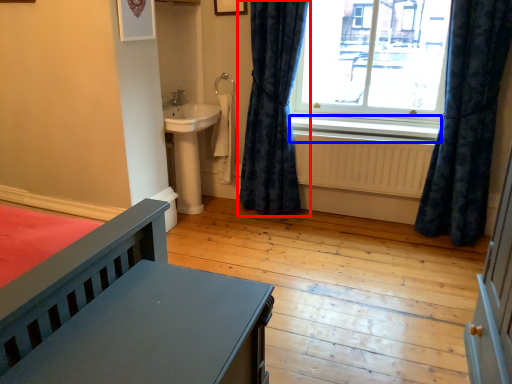
Question: Which object appears farthest to the camera in this image, curtain (highlighted by a red box) or window sill (highlighted by a blue box)?

Choices:
 (A) curtain
 (B) window sill

Answer: (B)